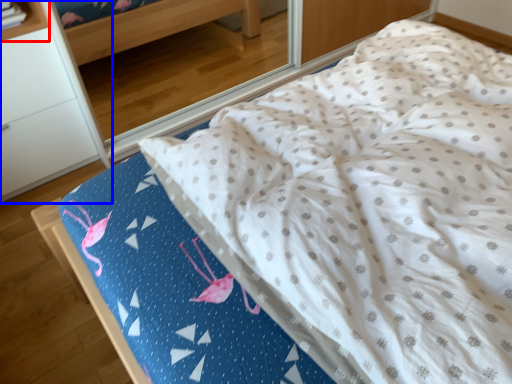
Question: Which object appears closest to the camera in this image, shelf (highlighted by a red box) or furniture (highlighted by a blue box)?

Choices:
 (A) shelf
 (B) furniture

Answer: (B)